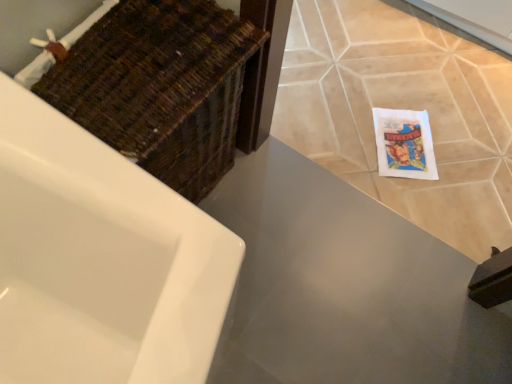
Question: Looking at the image, does woven brown basket at upper left seem bigger or smaller compared to matte gray countertop at center?

Choices:
 (A) small
 (B) big

Answer: (B)

Question: From a real-world perspective, relative to matte gray countertop at center, is woven brown basket at upper left vertically above or below?

Choices:
 (A) below
 (B) above

Answer: (B)

Question: Which is nearer to the woven brown basket at upper left?

Choices:
 (A) beige ceramic tile at lower right
 (B) matte gray countertop at center

Answer: (B)

Question: Based on their relative distances, which object is farther from the matte gray countertop at center?

Choices:
 (A) woven brown basket at upper left
 (B) beige ceramic tile at lower right

Answer: (A)